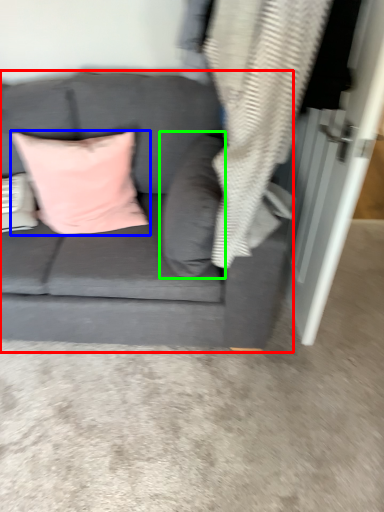
Question: Considering the real-world distances, which object is closest to studio couch (highlighted by a red box)? pillow (highlighted by a blue box) or pillow (highlighted by a green box).

Choices:
 (A) pillow
 (B) pillow

Answer: (B)